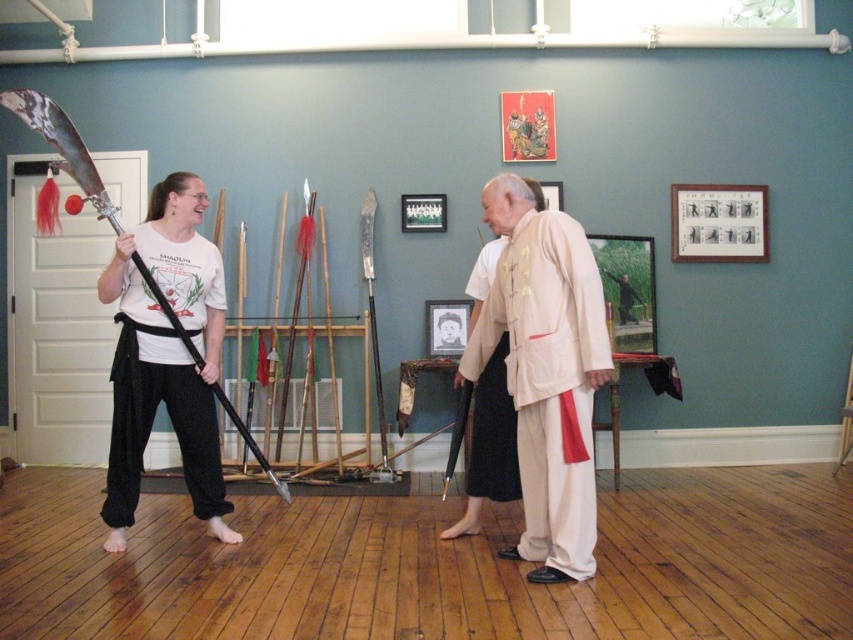
The width and height of the screenshot is (853, 640). What do you see at coordinates (544, 371) in the screenshot? I see `matte black sword at left` at bounding box center [544, 371].

Who is shorter, matte black sword at left or light beige silk robe at center?

light beige silk robe at center is shorter.

What are the coordinates of `matte black sword at left` in the screenshot? It's located at (544, 371).

The image size is (853, 640). I want to click on matte black sword at left, so click(x=544, y=371).

Does matte black sword at left appear over beige cotton robe at center?

Yes, matte black sword at left is above beige cotton robe at center.

Does matte black sword at left have a lesser width compared to beige cotton robe at center?

Incorrect, matte black sword at left's width is not less than beige cotton robe at center's.

The image size is (853, 640). Find the location of `matte black sword at left`. matte black sword at left is located at coordinates (544, 371).

Is point (215, 454) positioned in front of point (490, 374)?

That is False.

Is black cotton robe at left above light beige silk robe at center?

Correct, black cotton robe at left is located above light beige silk robe at center.

Is point (115, 513) positioned in front of point (468, 292)?

Yes, it is.

This screenshot has height=640, width=853. I want to click on black cotton robe at left, so click(x=155, y=408).